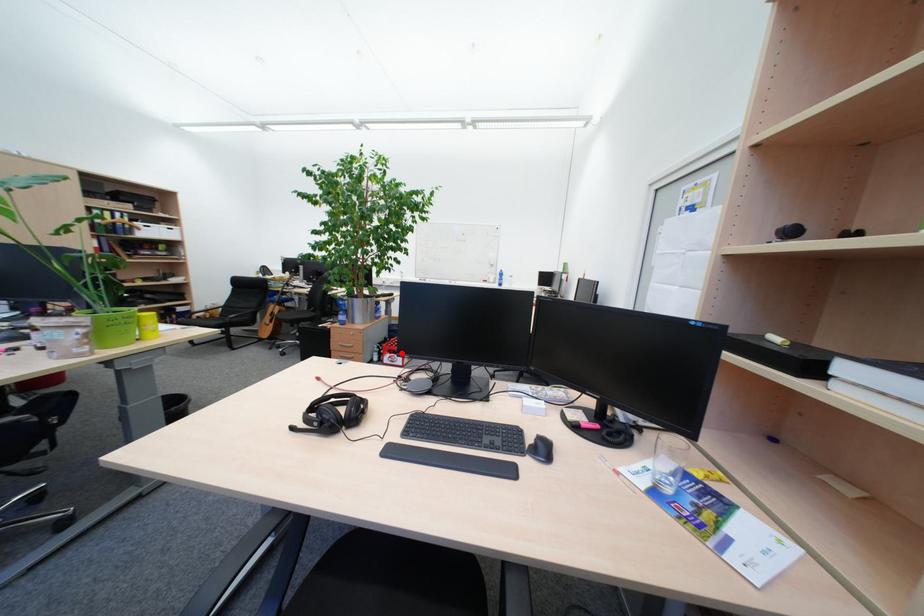
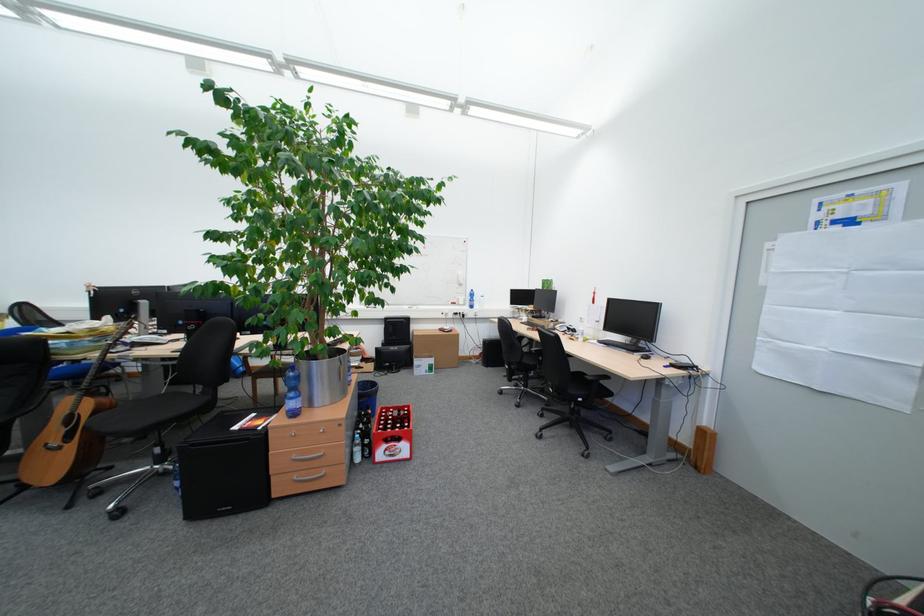
Question: I am providing you with two images of the same scene from different viewpoints. Image1 has a red point marked. In image2, the corresponding 3D location appears at what relative position? Reply with the corresponding letter.

Choices:
 (A) Closer
 (B) Farther

Answer: (A)